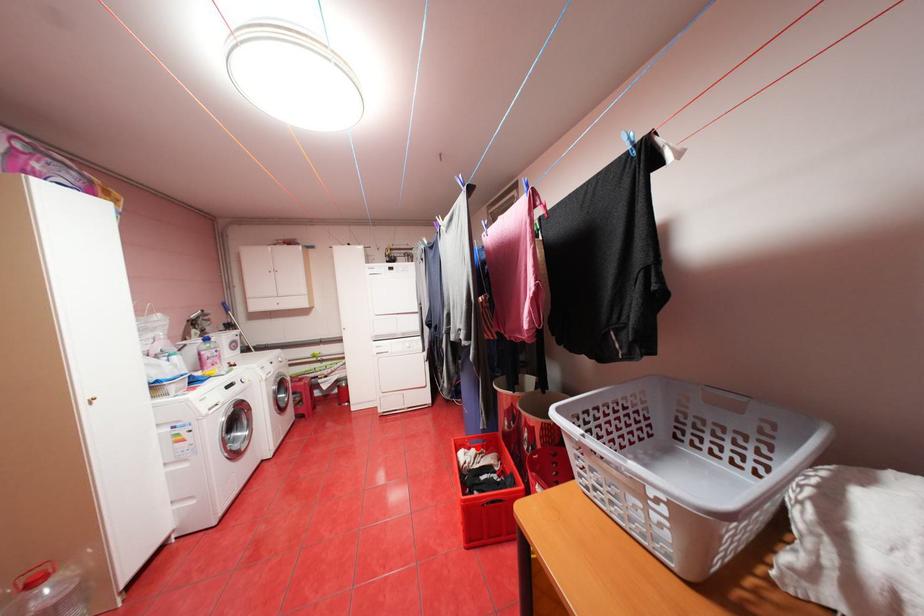
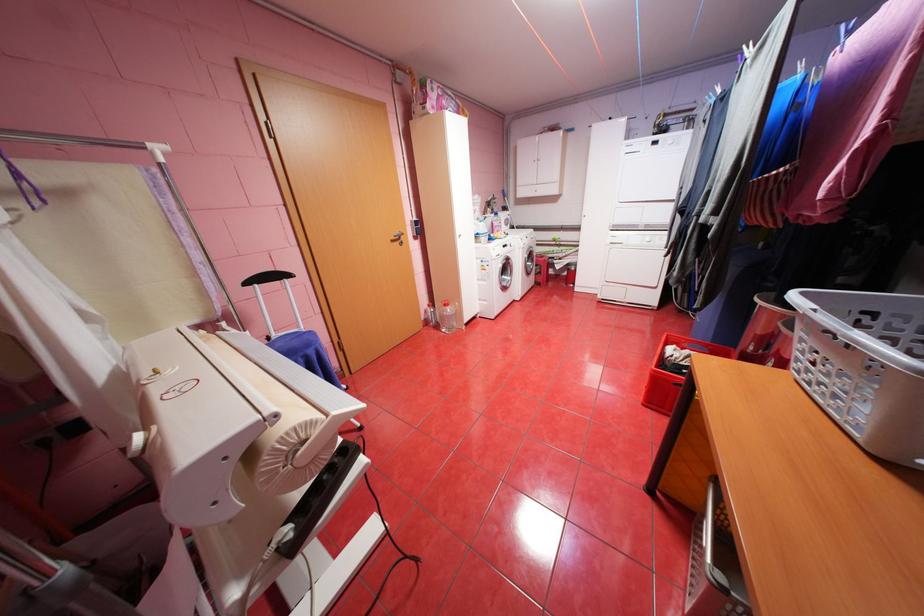
Question: I am providing you with two images of the same scene from different viewpoints. A red point is shown in image1. For the corresponding object point in image2, is it positioned nearer or farther from the camera?

Choices:
 (A) Nearer
 (B) Farther

Answer: (A)